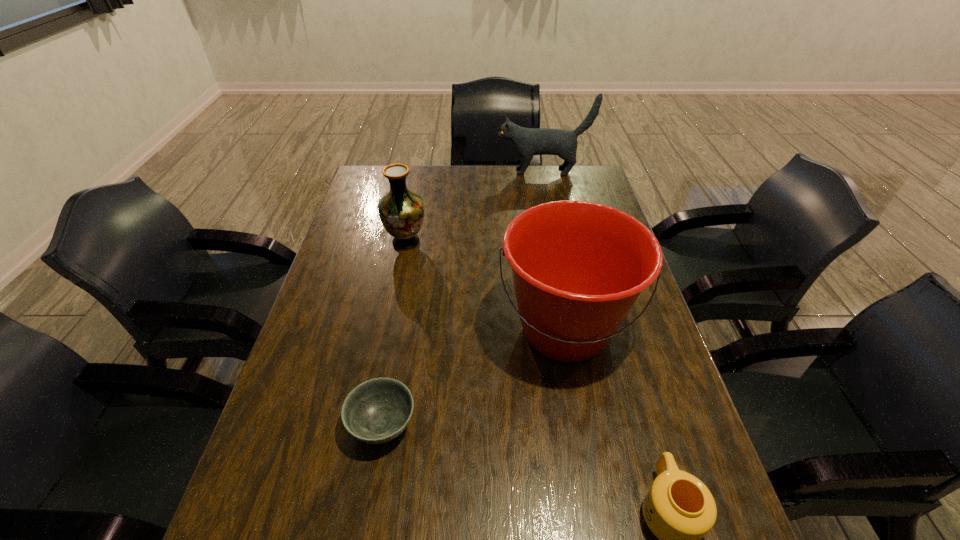
You are a GUI agent. You are given a task and a screenshot of the screen. Output one action in this format:
    pyautogui.click(x=<x>, y=<y>)
    Task: Click on the vacant space at the far right corner of the desktop
    Image resolution: width=960 pixels, height=540 pixels.
    Given the screenshot: What is the action you would take?
    click(603, 197)

Find the location of a particular element. vacant space in between the second farthest object and the bucket is located at coordinates (486, 286).

Find the location of a particular element. This screenshot has width=960, height=540. empty space between the bucket and the vase is located at coordinates (486, 286).

Identify which object is located as the nearest to the vase. Please provide its 2D coordinates. Your answer should be formatted as a tuple, i.e. [(x, y)], where the tuple contains the x and y coordinates of a point satisfying the conditions above.

[(578, 267)]

Identify which object is the second closest to the third farthest object. Please provide its 2D coordinates. Your answer should be formatted as a tuple, i.e. [(x, y)], where the tuple contains the x and y coordinates of a point satisfying the conditions above.

[(679, 509)]

Identify the location of vacant space that satisfies the following two spatial constraints: 1. at the face of the farthest object; 2. with the handle attached to the rim of the third farthest object. (576, 330).